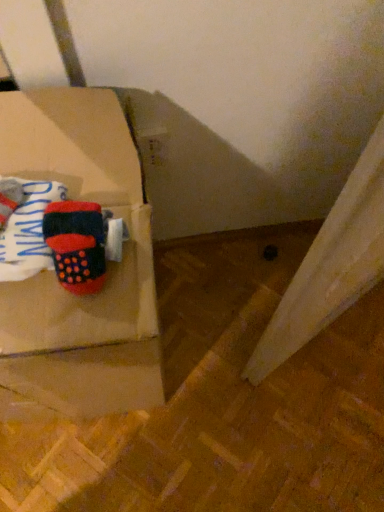
Question: From the image's perspective, is knitted wool socks at left under matte cardboard box at left?

Choices:
 (A) yes
 (B) no

Answer: (B)

Question: Is knitted wool socks at left further to the viewer compared to matte cardboard box at left?

Choices:
 (A) yes
 (B) no

Answer: (A)

Question: Is knitted wool socks at left positioned with its back to matte cardboard box at left?

Choices:
 (A) yes
 (B) no

Answer: (B)

Question: From a real-world perspective, is knitted wool socks at left located beneath matte cardboard box at left?

Choices:
 (A) yes
 (B) no

Answer: (B)

Question: Can you confirm if knitted wool socks at left is wider than matte cardboard box at left?

Choices:
 (A) no
 (B) yes

Answer: (A)

Question: Considering their positions, is matte cardboard box at left located in front of or behind knitted wool socks at left?

Choices:
 (A) behind
 (B) front

Answer: (B)

Question: In terms of size, does matte cardboard box at left appear bigger or smaller than knitted wool socks at left?

Choices:
 (A) small
 (B) big

Answer: (B)

Question: From a real-world perspective, is matte cardboard box at left positioned above or below knitted wool socks at left?

Choices:
 (A) below
 (B) above

Answer: (A)

Question: Does point (109, 325) appear closer or farther from the camera than point (23, 240)?

Choices:
 (A) closer
 (B) farther

Answer: (A)

Question: From a real-world perspective, relative to knitted wool socks at left, is velvet-like red phone at upper left vertically above or below?

Choices:
 (A) below
 (B) above

Answer: (A)

Question: Is point (66, 204) positioned closer to the camera than point (18, 242)?

Choices:
 (A) closer
 (B) farther

Answer: (B)

Question: From the image's perspective, relative to knitted wool socks at left, is velvet-like red phone at upper left above or below?

Choices:
 (A) below
 (B) above

Answer: (A)

Question: Considering the positions of velvet-like red phone at upper left and knitted wool socks at left in the image, is velvet-like red phone at upper left taller or shorter than knitted wool socks at left?

Choices:
 (A) tall
 (B) short

Answer: (B)

Question: Is knitted wool socks at left bigger or smaller than matte cardboard box at left?

Choices:
 (A) small
 (B) big

Answer: (A)

Question: Considering their positions, is knitted wool socks at left located in front of or behind matte cardboard box at left?

Choices:
 (A) behind
 (B) front

Answer: (A)